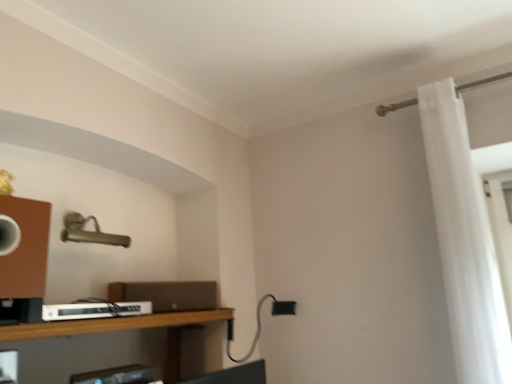
Question: Is wooden shelf at lower left closer to the viewer compared to white sheer curtain at right?

Choices:
 (A) no
 (B) yes

Answer: (B)

Question: From the image's perspective, is wooden shelf at lower left located above white sheer curtain at right?

Choices:
 (A) yes
 (B) no

Answer: (B)

Question: Are wooden shelf at lower left and white sheer curtain at right making contact?

Choices:
 (A) no
 (B) yes

Answer: (A)

Question: Considering the relative sizes of wooden shelf at lower left and white sheer curtain at right in the image provided, is wooden shelf at lower left shorter than white sheer curtain at right?

Choices:
 (A) yes
 (B) no

Answer: (A)

Question: Does wooden shelf at lower left have a smaller size compared to white sheer curtain at right?

Choices:
 (A) no
 (B) yes

Answer: (B)

Question: Is wooden shelf at lower left taller than white sheer curtain at right?

Choices:
 (A) no
 (B) yes

Answer: (A)

Question: From a real-world perspective, is white sheer curtain at right positioned over white plastic cable box at lower left based on gravity?

Choices:
 (A) yes
 (B) no

Answer: (A)

Question: Does white sheer curtain at right have a lesser height compared to white plastic cable box at lower left?

Choices:
 (A) yes
 (B) no

Answer: (B)

Question: Can you confirm if white sheer curtain at right is positioned to the left of white plastic cable box at lower left?

Choices:
 (A) yes
 (B) no

Answer: (B)

Question: Does white sheer curtain at right have a lesser width compared to white plastic cable box at lower left?

Choices:
 (A) no
 (B) yes

Answer: (B)

Question: Is white sheer curtain at right directly adjacent to white plastic cable box at lower left?

Choices:
 (A) no
 (B) yes

Answer: (A)

Question: From the image's perspective, is white sheer curtain at right on top of white plastic cable box at lower left?

Choices:
 (A) yes
 (B) no

Answer: (A)

Question: Can you confirm if white sheer curtain at right is taller than wooden shelf at lower left?

Choices:
 (A) no
 (B) yes

Answer: (B)